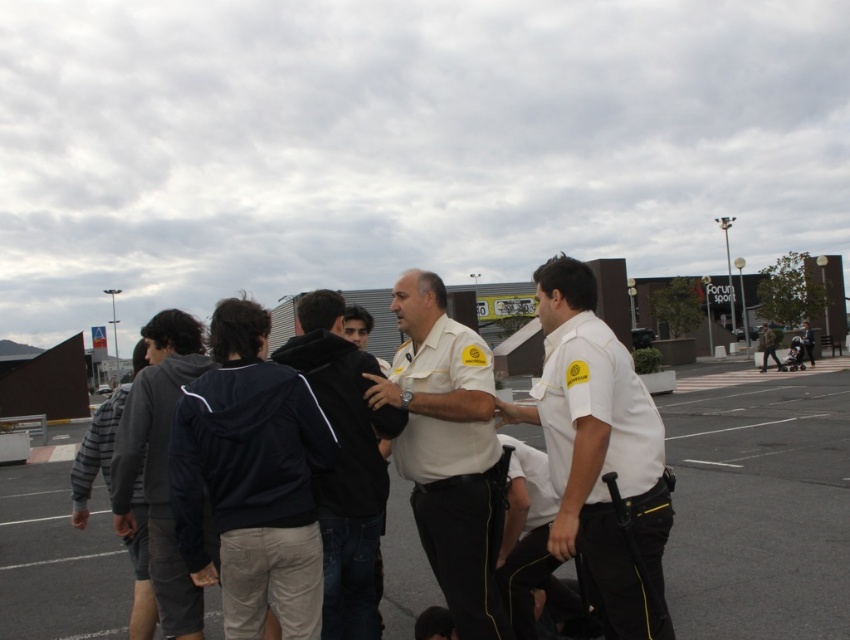
At what (x,y) coordinates should I click in order to perform the action: click on white uniform at center. Please return your answer as a coordinate pair (x, y). Looking at the image, I should click on (448, 451).

What do you see at coordinates (448, 451) in the screenshot? I see `white uniform at center` at bounding box center [448, 451].

This screenshot has height=640, width=850. In order to click on white uniform at center in this screenshot , I will do pos(448,451).

This screenshot has height=640, width=850. In order to click on white uniform at center in this screenshot , I will do `click(448, 451)`.

Is dark blue hoodie at center to the left of dark gray hoodie at left from the viewer's perspective?

In fact, dark blue hoodie at center is to the right of dark gray hoodie at left.

Between dark blue hoodie at center and dark gray hoodie at left, which one is positioned higher?

Positioned higher is dark blue hoodie at center.

Between point (202, 385) and point (187, 582), which one is positioned behind?

The point (187, 582) is behind.

The width and height of the screenshot is (850, 640). I want to click on dark blue hoodie at center, so click(x=251, y=477).

Is black uniform pants at center to the right of striped cotton sweater at left from the viewer's perspective?

Yes, black uniform pants at center is to the right of striped cotton sweater at left.

Find the location of a particular element. The image size is (850, 640). black uniform pants at center is located at coordinates (758, 502).

Locate an element on the screen. The image size is (850, 640). black uniform pants at center is located at coordinates (758, 502).